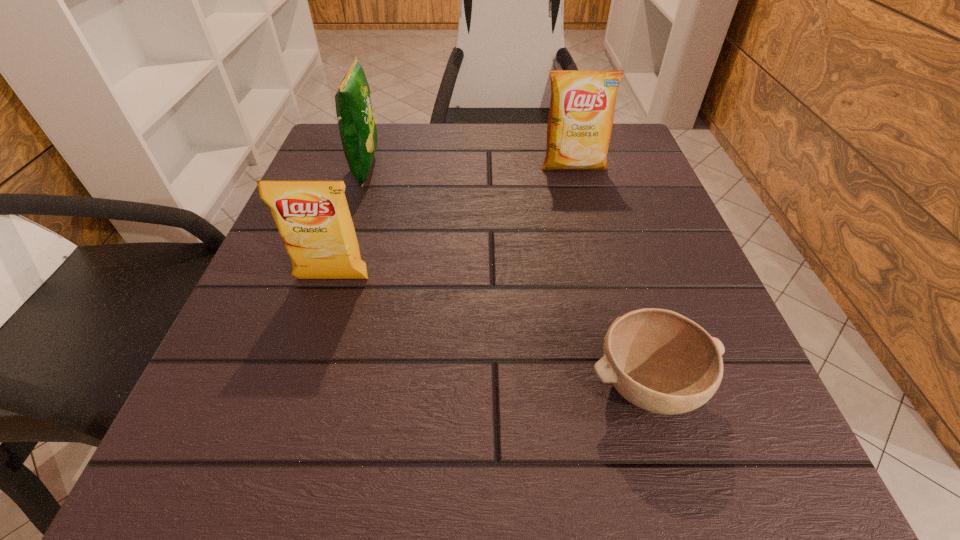
Where is `free space between the bowl and the rightmost crisp (potato chip)`? This screenshot has width=960, height=540. free space between the bowl and the rightmost crisp (potato chip) is located at coordinates (610, 275).

Where is `unoccupied area between the bowl and the rightmost crisp (potato chip)`? The height and width of the screenshot is (540, 960). unoccupied area between the bowl and the rightmost crisp (potato chip) is located at coordinates (610, 275).

Image resolution: width=960 pixels, height=540 pixels. I want to click on free space between the nearest crisp (potato chip) and the rightmost crisp (potato chip), so click(453, 222).

At what (x,y) coordinates should I click in order to perform the action: click on free point between the nearest object and the nearest crisp (potato chip). Please return your answer as a coordinate pair (x, y). Looking at the image, I should click on (490, 332).

The image size is (960, 540). Find the location of `the third closest object to the rightmost crisp (potato chip)`. the third closest object to the rightmost crisp (potato chip) is located at coordinates click(659, 360).

Where is `object that can be found as the closest to the nearest object`? The width and height of the screenshot is (960, 540). object that can be found as the closest to the nearest object is located at coordinates (313, 218).

Identify which crisp (potato chip) is the second nearest to the shortest object. Please provide its 2D coordinates. Your answer should be formatted as a tuple, i.e. [(x, y)], where the tuple contains the x and y coordinates of a point satisfying the conditions above.

[(582, 105)]

Choose which crisp (potato chip) is the third nearest neighbor to the nearest object. Please provide its 2D coordinates. Your answer should be formatted as a tuple, i.e. [(x, y)], where the tuple contains the x and y coordinates of a point satisfying the conditions above.

[(358, 132)]

Locate an element on the screen. vacant area that satisfies the following two spatial constraints: 1. on the front-facing side of the rightmost crisp (potato chip); 2. on the left side of the shortest object is located at coordinates (633, 385).

I want to click on vacant region that satisfies the following two spatial constraints: 1. on the front-facing side of the rightmost crisp (potato chip); 2. on the left side of the nearest object, so click(x=633, y=385).